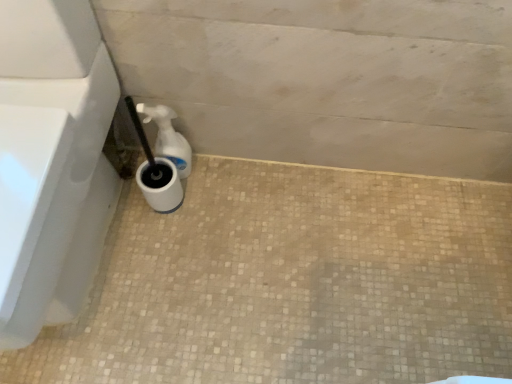
Question: Considering the positions of white matte concrete at lower center and white plastic spray bottle at lower left in the image, is white matte concrete at lower center bigger or smaller than white plastic spray bottle at lower left?

Choices:
 (A) small
 (B) big

Answer: (B)

Question: Considering their positions, is white matte concrete at lower center located in front of or behind white plastic spray bottle at lower left?

Choices:
 (A) front
 (B) behind

Answer: (A)

Question: Based on their relative distances, which object is farther from the white plastic spray bottle at lower left?

Choices:
 (A) white glossy toilet at lower left
 (B) white matte concrete at lower center

Answer: (B)

Question: Which of these objects is positioned closest to the white plastic spray bottle at lower left?

Choices:
 (A) white glossy toilet at lower left
 (B) white matte concrete at lower center

Answer: (A)